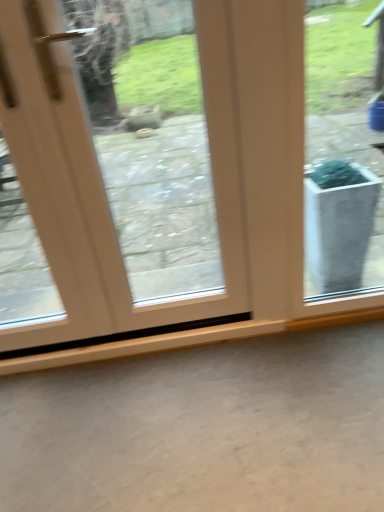
Question: Are gray matte concrete at lower center and white glossy door at center far apart?

Choices:
 (A) yes
 (B) no

Answer: (B)

Question: Is gray matte concrete at lower center oriented away from white glossy door at center?

Choices:
 (A) yes
 (B) no

Answer: (B)

Question: Does gray matte concrete at lower center have a greater height compared to white glossy door at center?

Choices:
 (A) yes
 (B) no

Answer: (B)

Question: Is gray matte concrete at lower center outside white glossy door at center?

Choices:
 (A) no
 (B) yes

Answer: (B)

Question: From a real-world perspective, is gray matte concrete at lower center under white glossy door at center?

Choices:
 (A) yes
 (B) no

Answer: (A)

Question: From the image's perspective, is gray matte concrete at lower center under white glossy door at center?

Choices:
 (A) no
 (B) yes

Answer: (B)

Question: Considering the relative positions of white glossy door at center and gray matte concrete at lower center in the image provided, is white glossy door at center in front of gray matte concrete at lower center?

Choices:
 (A) yes
 (B) no

Answer: (A)

Question: Can you confirm if white glossy door at center is smaller than gray matte concrete at lower center?

Choices:
 (A) yes
 (B) no

Answer: (B)

Question: Is white glossy door at center outside gray matte concrete at lower center?

Choices:
 (A) yes
 (B) no

Answer: (A)

Question: From the image's perspective, does white glossy door at center appear higher than gray matte concrete at lower center?

Choices:
 (A) no
 (B) yes

Answer: (B)

Question: From a real-world perspective, is white glossy door at center located higher than gray matte concrete at lower center?

Choices:
 (A) no
 (B) yes

Answer: (B)

Question: Is gray matte concrete at lower center surrounded by white glossy door at center?

Choices:
 (A) no
 (B) yes

Answer: (A)

Question: From their relative heights in the image, would you say white glossy door at center is taller or shorter than gray matte concrete at lower center?

Choices:
 (A) short
 (B) tall

Answer: (B)